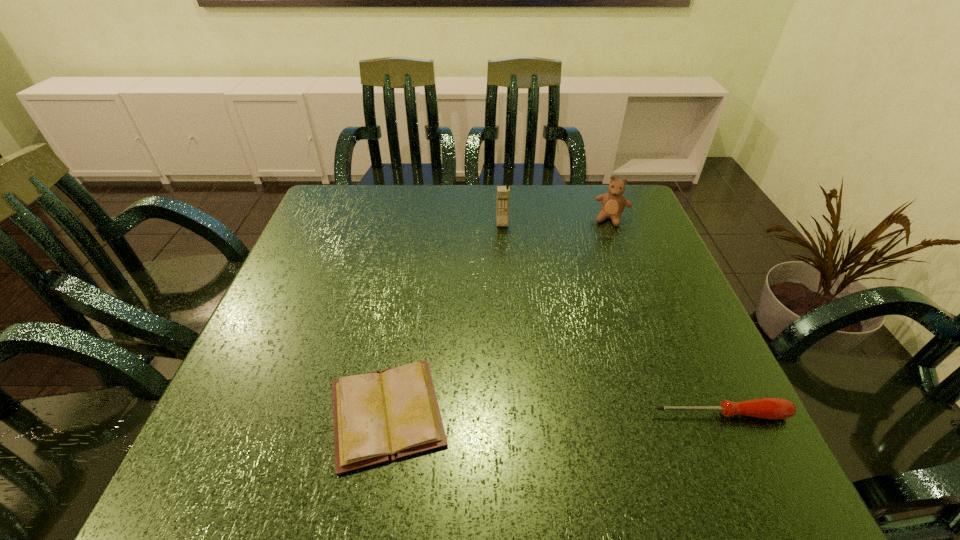
This screenshot has height=540, width=960. In order to click on free spot located 0.330m on the front-facing side of the teddy bear in this screenshot , I will do `click(578, 310)`.

Image resolution: width=960 pixels, height=540 pixels. What are the coordinates of `vacant space located on the front-facing side of the teddy bear` in the screenshot? It's located at (597, 258).

Find the location of a particular element. This screenshot has width=960, height=540. vacant space located 0.160m on the front-facing side of the teddy bear is located at coordinates (595, 263).

Where is `cellular telephone that is at the far edge`? cellular telephone that is at the far edge is located at coordinates (503, 192).

At what (x,y) coordinates should I click in order to perform the action: click on teddy bear situated at the far edge. Please return your answer as a coordinate pair (x, y). Looking at the image, I should click on (613, 203).

Where is `diary situated at the near edge`? diary situated at the near edge is located at coordinates (383, 416).

You are a GUI agent. You are given a task and a screenshot of the screen. Output one action in this format:
    pyautogui.click(x=<x>, y=<y>)
    Task: Click on the screwdriver located in the near edge section of the desktop
    The height and width of the screenshot is (540, 960).
    Given the screenshot: What is the action you would take?
    pyautogui.click(x=772, y=408)

The image size is (960, 540). Find the location of `screwdriver that is at the right edge`. screwdriver that is at the right edge is located at coordinates (772, 408).

Locate an element on the screen. teddy bear that is at the right edge is located at coordinates (613, 203).

In order to click on object present at the far right corner in this screenshot , I will do `click(613, 203)`.